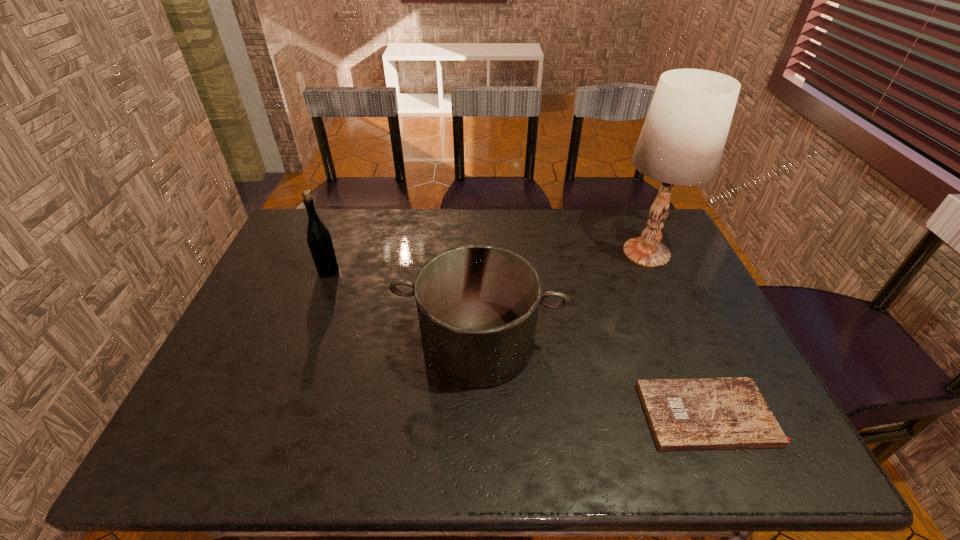
Locate an element on the screen. This screenshot has width=960, height=540. free space that satisfies the following two spatial constraints: 1. on the back side of the lamp; 2. on the left side of the beer bottle is located at coordinates (336, 253).

The width and height of the screenshot is (960, 540). I want to click on free space in the image that satisfies the following two spatial constraints: 1. on the front side of the beer bottle; 2. on the right side of the Bible, so click(274, 414).